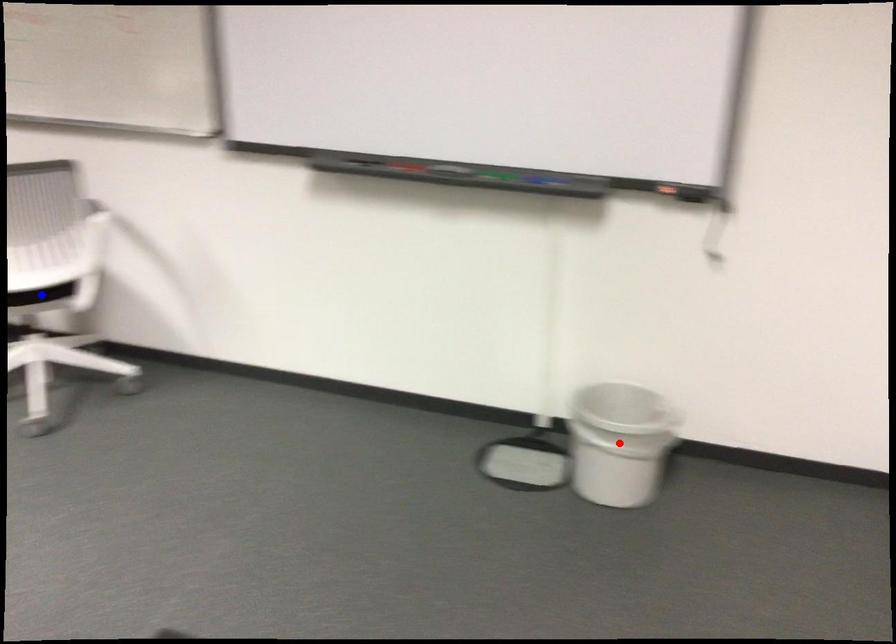
Question: Two points are marked on the image. Which point is closer to the camera?

Choices:
 (A) Blue point is closer.
 (B) Red point is closer.

Answer: (B)